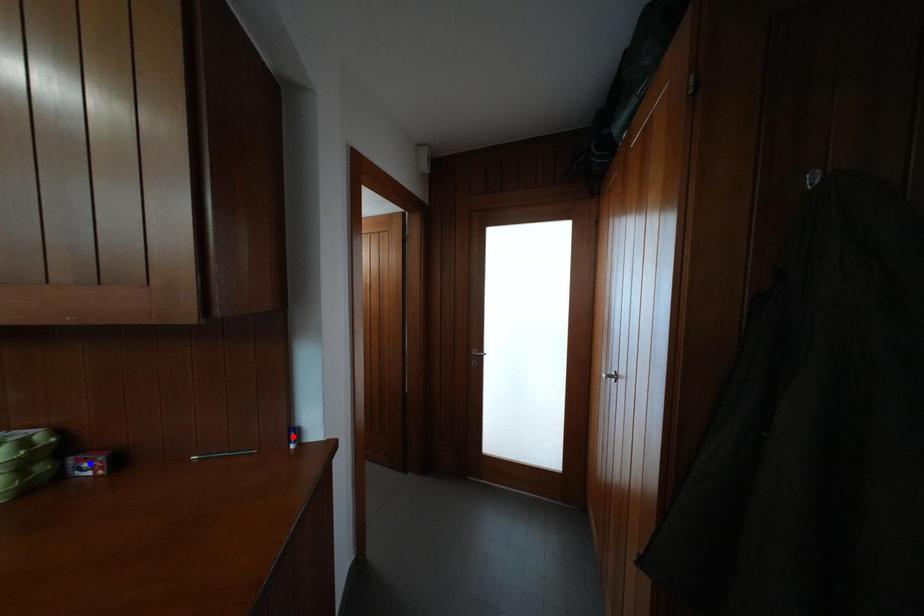
Question: In the image, two points are highlighted. Which point is nearer to the camera? Reply with the corresponding letter.

Choices:
 (A) blue point
 (B) red point

Answer: (A)